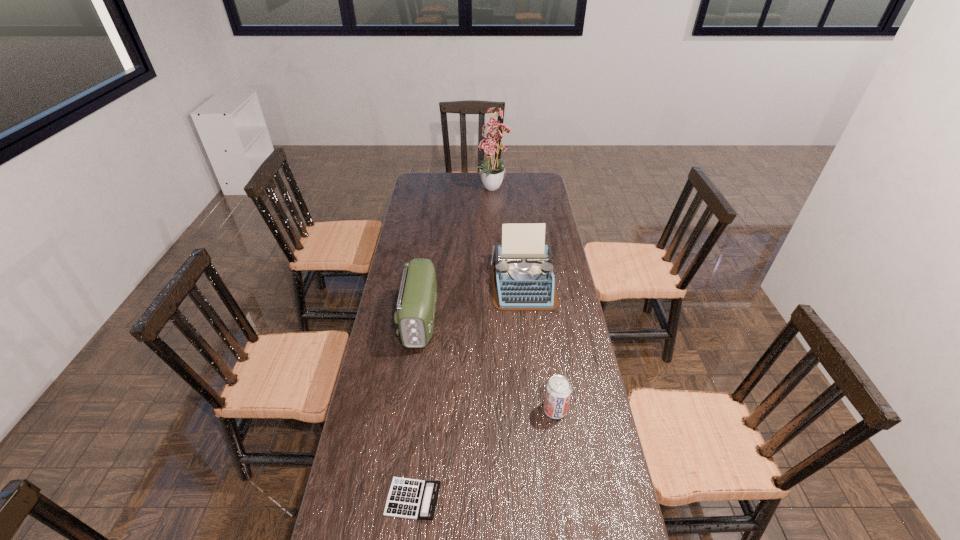
Find the location of a particular element. vacant point located on the front-facing side of the radio_receiver is located at coordinates (413, 371).

Find the location of a particular element. The image size is (960, 540). vacant space located on the left of the second nearest object is located at coordinates (500, 409).

Identify the location of free space located 0.060m on the right of the calculator. (463, 499).

Where is `object that is at the far edge`? The width and height of the screenshot is (960, 540). object that is at the far edge is located at coordinates (492, 174).

Where is `radio_receiver located in the left edge section of the desktop`? Image resolution: width=960 pixels, height=540 pixels. radio_receiver located in the left edge section of the desktop is located at coordinates (416, 304).

This screenshot has height=540, width=960. Find the location of `calculator that is at the left edge`. calculator that is at the left edge is located at coordinates (408, 498).

I want to click on typewriter situated at the right edge, so click(522, 275).

Locate an element on the screen. soda can that is at the right edge is located at coordinates (558, 390).

Where is `vacant space at the far edge`? vacant space at the far edge is located at coordinates (511, 174).

The height and width of the screenshot is (540, 960). In order to click on free space at the left edge of the desktop in this screenshot , I will do `click(418, 228)`.